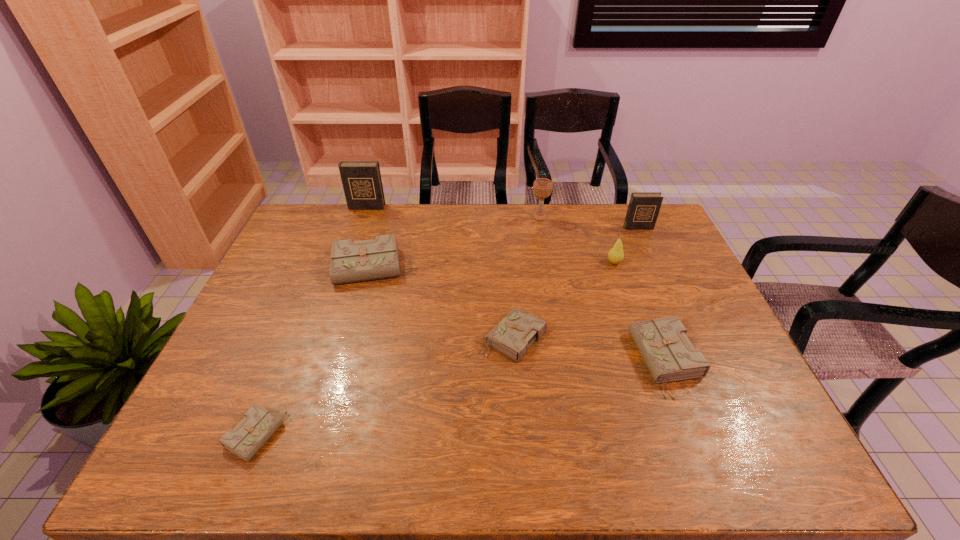
Locate an element on the screen. The width and height of the screenshot is (960, 540). vacant space at the right edge of the desktop is located at coordinates (744, 403).

The height and width of the screenshot is (540, 960). What are the coordinates of `vacant space at the far left corner of the desktop` in the screenshot? It's located at (295, 228).

The width and height of the screenshot is (960, 540). I want to click on vacant space at the far right corner of the desktop, so click(664, 220).

The image size is (960, 540). What are the coordinates of `free spot between the pear and the beige chalice` in the screenshot? It's located at (577, 240).

Image resolution: width=960 pixels, height=540 pixels. In order to click on vacant area between the second farthest object and the fourth tallest object in this screenshot , I will do tap(577, 240).

You are a GUI agent. You are given a task and a screenshot of the screen. Output one action in this format:
    pyautogui.click(x=<x>, y=<y>)
    Task: Click on the free space between the second farthest diary and the pear
    The image size is (960, 540).
    Given the screenshot: What is the action you would take?
    pyautogui.click(x=626, y=245)

This screenshot has width=960, height=540. Find the location of `free space between the fifth shortest diary and the farther dark diary`. free space between the fifth shortest diary and the farther dark diary is located at coordinates (502, 217).

The height and width of the screenshot is (540, 960). Identify the location of free spot between the left dark diary and the nearer dark diary. (502, 217).

Identify the location of unoccupied area between the second farthest object and the pear. (577, 240).

Where is `free space between the fourth tallest object and the nearest green diary`? The height and width of the screenshot is (540, 960). free space between the fourth tallest object and the nearest green diary is located at coordinates (435, 349).